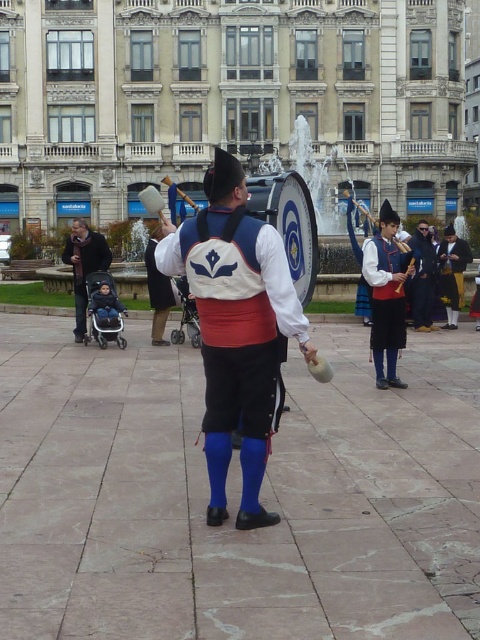
Does point (231, 205) come in front of point (104, 243)?

Yes.

Locate an element on the screen. This screenshot has width=480, height=640. matte blue fabric drum at center is located at coordinates (237, 330).

Which is in front, point (256, 273) or point (395, 330)?

Positioned in front is point (256, 273).

Is matte blue fabric drum at center closer to camera compared to matte blue fabric hat at right?

Yes, it is.

Locate an element on the screen. This screenshot has height=640, width=480. matte blue fabric drum at center is located at coordinates (237, 330).

Can you confirm if matte blue fabric drum at center is taller than velvet brown vest at center?

Indeed, matte blue fabric drum at center has a greater height compared to velvet brown vest at center.

Does point (240, 285) lie behind point (454, 328)?

No.

Locate an element on the screen. The image size is (480, 640). matte blue fabric drum at center is located at coordinates (237, 330).